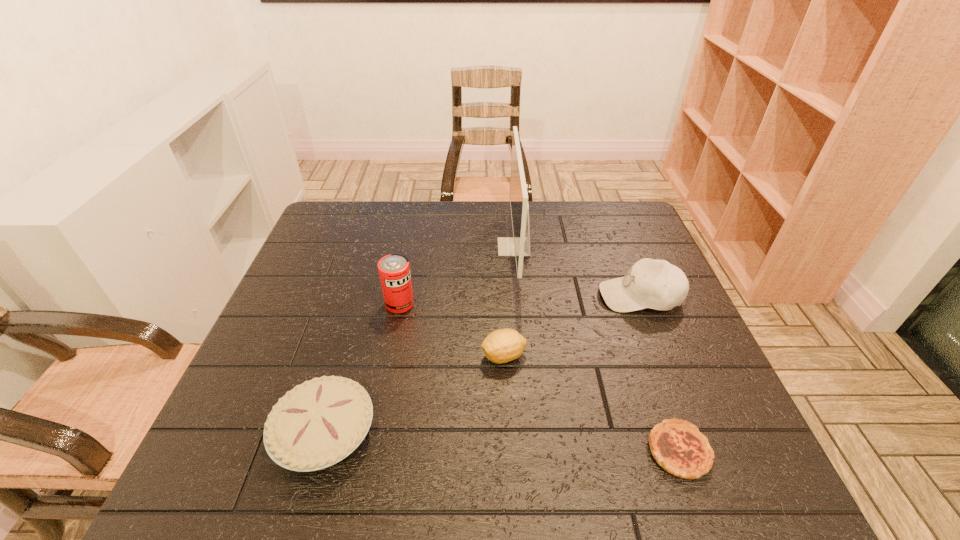
Identify the location of the tallest object. [x=519, y=246].

Where is `the second tallest object`? The height and width of the screenshot is (540, 960). the second tallest object is located at coordinates (394, 270).

Find the location of a particular element. baseball cap is located at coordinates (656, 284).

Where is `the third nearest object`? Image resolution: width=960 pixels, height=540 pixels. the third nearest object is located at coordinates (501, 346).

This screenshot has height=540, width=960. Find the location of `pie`. pie is located at coordinates (317, 424).

The height and width of the screenshot is (540, 960). Identify the location of quiche. (677, 446).

Find the location of `vacant space situated 0.130m on the front-facing side of the monitor`. vacant space situated 0.130m on the front-facing side of the monitor is located at coordinates (455, 247).

Locate an element on the screen. vacant space located 0.110m on the front-facing side of the monitor is located at coordinates (462, 247).

At what (x,y) coordinates should I click in order to perform the action: click on blank area located on the front-facing side of the monitor. Please return your answer as a coordinate pair (x, y). Looking at the image, I should click on (372, 247).

Where is `vacant space positioned on the back of the can`? vacant space positioned on the back of the can is located at coordinates (406, 272).